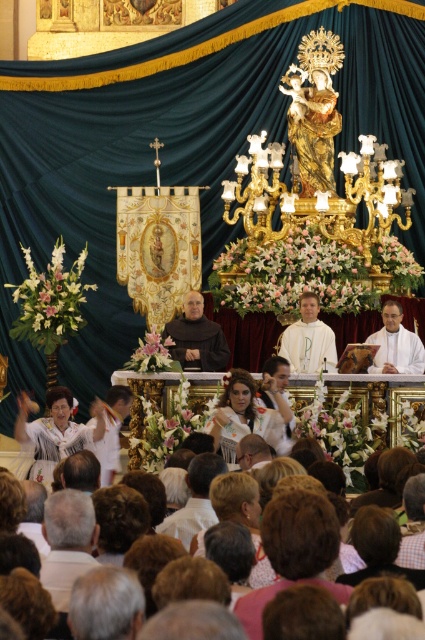
Question: Which of the following is the closest to the observer?

Choices:
 (A) (201, 332)
 (B) (87, 536)
 (C) (317, 307)

Answer: (B)

Question: Considering the real-world distances, which object is farthest from the white cloth at lower center?

Choices:
 (A) white cloth at center
 (B) white clothed person at center

Answer: (B)

Question: Which of the following is the farthest from the observer?

Choices:
 (A) (183, 349)
 (B) (397, 346)

Answer: (B)

Question: Considering the relative positions of white cloth at center and white clothed person at center in the image provided, where is white cloth at center located with respect to white clothed person at center?

Choices:
 (A) below
 (B) above

Answer: (B)

Question: Where is white cloth at lower center located in relation to white clothed person at center in the image?

Choices:
 (A) above
 (B) below

Answer: (B)

Question: Does white cloth at center have a smaller size compared to white clothed person at center?

Choices:
 (A) no
 (B) yes

Answer: (B)